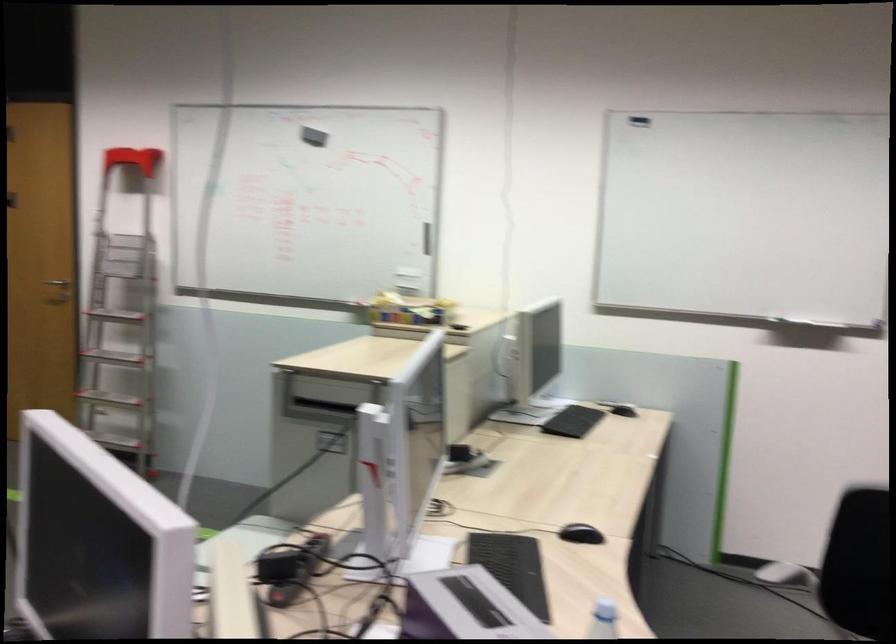
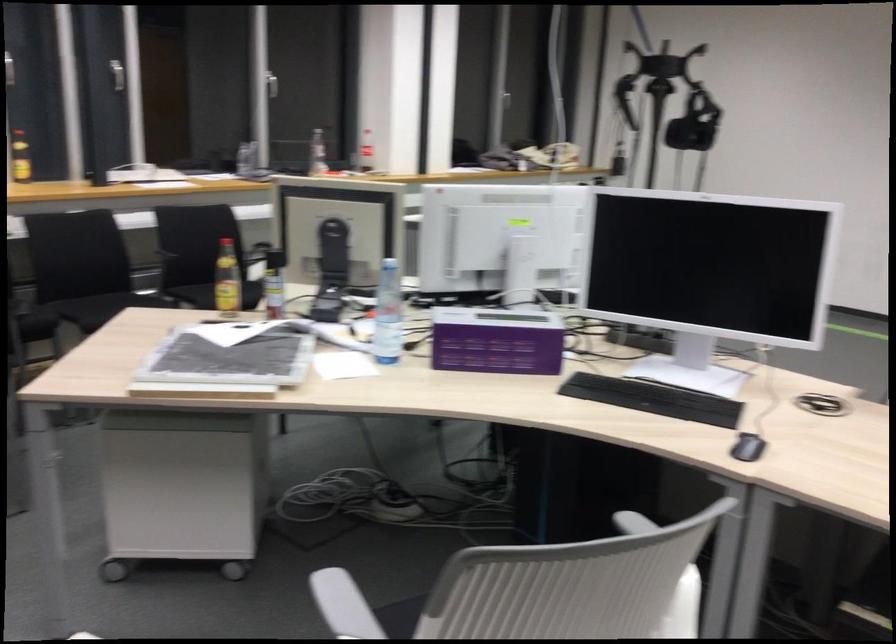
Where in the second image is the point corresponding to (547,535) from the first image?

(747, 447)